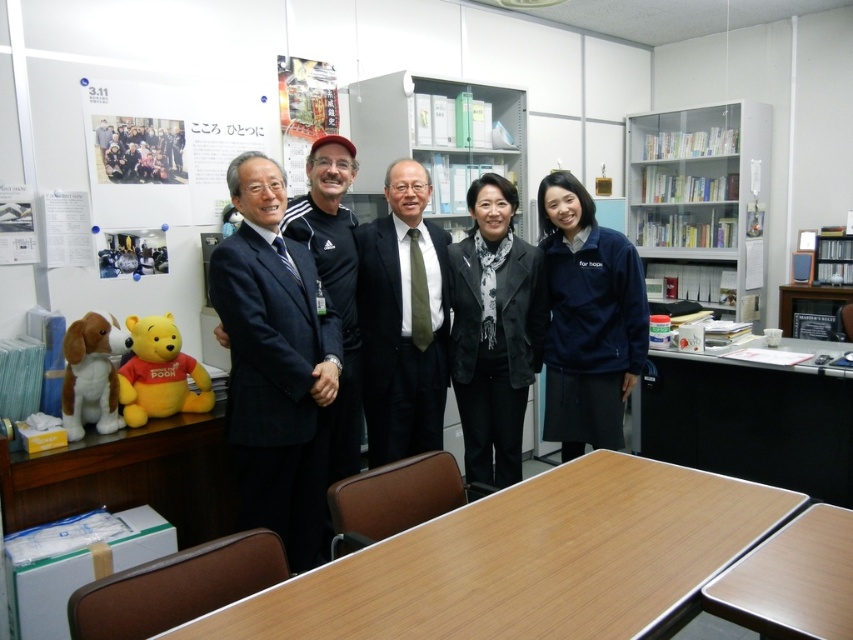
In the scene shown: You are a delivery person who needs to place a package that is 10 feet long between the white glass bookshelf at upper right and the black suede jacket at center. Can you fit the package between them?

The distance between the white glass bookshelf at upper right and the black suede jacket at center is 8.97 feet, which is shorter than the 10 feet length of the package. Therefore, the package cannot fit between them.